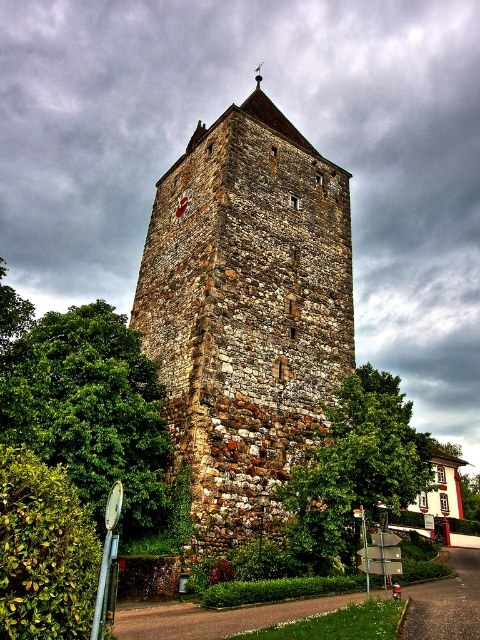
You are standing at the point closest to the tower. There are two points marked in the image, one at coordinates point (310, 196) and another at point (312, 570). Which point is farther away from you?

Point (310, 196) is behind point (312, 570), so the point farther away from you is point (310, 196).

You are standing in a park and want to take a photo of the rustic stone tower at center and the green leafy tree at left. Which object should you focus on first to ensure it appears sharp in your photo?

You should focus on the rustic stone tower at center first because it is closer to you than the green leafy tree at left, so focusing on the closer object ensures it will be sharp.